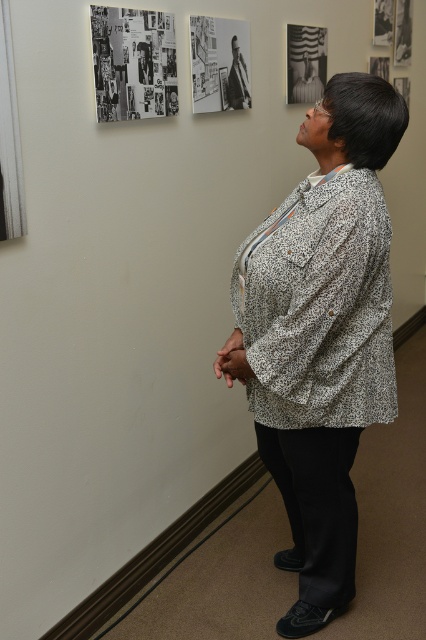
Question: Does white printed shirt at center appear on the left side of black paper collage at upper left?

Choices:
 (A) no
 (B) yes

Answer: (A)

Question: Considering the relative positions of black and white photograph at upper center and metallic silver frame at upper center in the image provided, where is black and white photograph at upper center located with respect to metallic silver frame at upper center?

Choices:
 (A) above
 (B) below

Answer: (B)

Question: Observing the image, what is the correct spatial positioning of white printed shirt at center in reference to black paper collage at upper left?

Choices:
 (A) right
 (B) left

Answer: (A)

Question: Which object is farther from the camera taking this photo?

Choices:
 (A) black paper collage at upper left
 (B) white printed shirt at center
 (C) black and white photograph at upper center

Answer: (C)

Question: Which point appears farthest from the camera in this image?

Choices:
 (A) (317, 51)
 (B) (195, 40)
 (C) (106, 64)
 (D) (388, 282)

Answer: (A)

Question: Among these points, which one is farthest from the camera?

Choices:
 (A) (293, 48)
 (B) (236, 61)

Answer: (A)